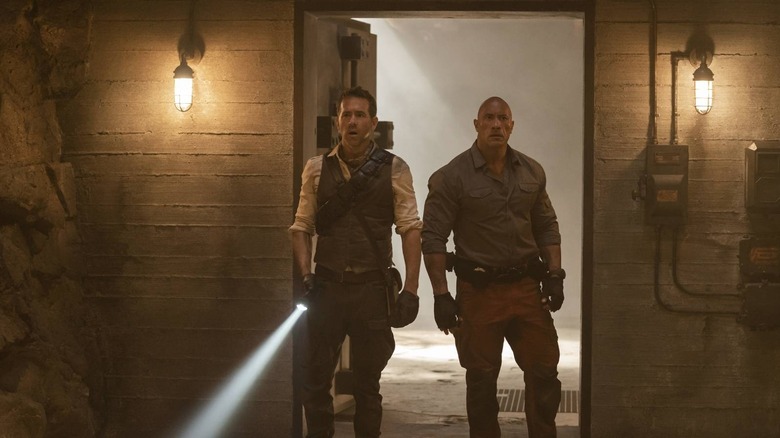
Locate an element on the screen. The image size is (780, 438). door is located at coordinates (367, 73).